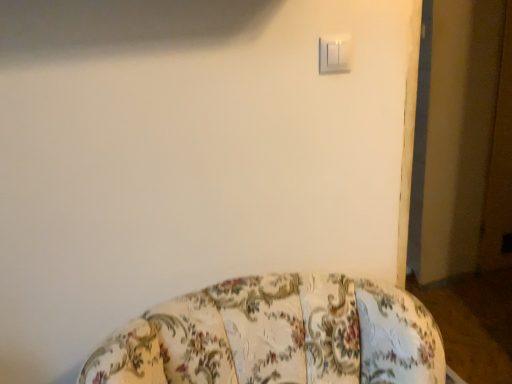
What do you see at coordinates (335, 53) in the screenshot? This screenshot has width=512, height=384. I see `white plastic light switch at upper right` at bounding box center [335, 53].

In order to face white plastic light switch at upper right, should I rotate leftwards or rightwards?

Rotate your view right by about 10.086°.

The image size is (512, 384). In order to click on white plastic light switch at upper right in this screenshot , I will do `click(335, 53)`.

Where is `white plastic light switch at upper right`? Image resolution: width=512 pixels, height=384 pixels. white plastic light switch at upper right is located at coordinates (335, 53).